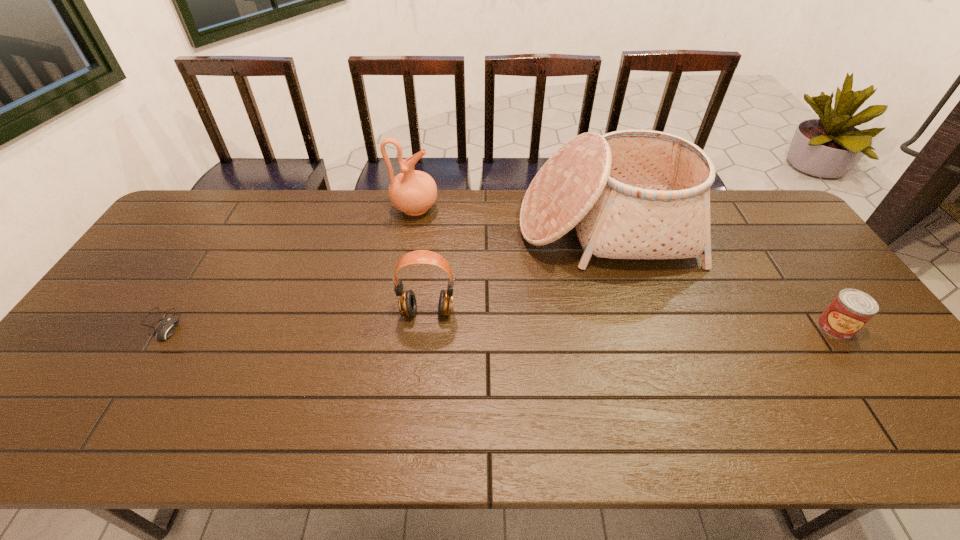
Where is `vacant space located 0.230m on the back of the can`? The height and width of the screenshot is (540, 960). vacant space located 0.230m on the back of the can is located at coordinates (786, 256).

Identify the location of free location located 0.290m on the right of the shortest object. Image resolution: width=960 pixels, height=540 pixels. (289, 324).

Where is `basket that is at the far edge`? The height and width of the screenshot is (540, 960). basket that is at the far edge is located at coordinates (631, 194).

You are a GUI agent. You are given a task and a screenshot of the screen. Output one action in this format:
    pyautogui.click(x=<x>, y=<y>)
    Task: Click on the pottery positioned at the far edge
    This screenshot has width=960, height=540.
    Given the screenshot: What is the action you would take?
    pyautogui.click(x=413, y=192)

This screenshot has width=960, height=540. What are the coordinates of `object at the left edge` in the screenshot? It's located at 167,326.

Identify the location of object situated at the right edge. (851, 309).

Find the location of a particular element. The width and height of the screenshot is (960, 540). vacant region at the far edge of the desktop is located at coordinates (476, 214).

In the image, there is a desktop. Where is `vacant space at the near edge`? vacant space at the near edge is located at coordinates (691, 445).

Where is `vacant space at the right edge`? Image resolution: width=960 pixels, height=540 pixels. vacant space at the right edge is located at coordinates (850, 359).

Locate an element on the screen. vacant space at the far left corner of the desktop is located at coordinates (196, 219).